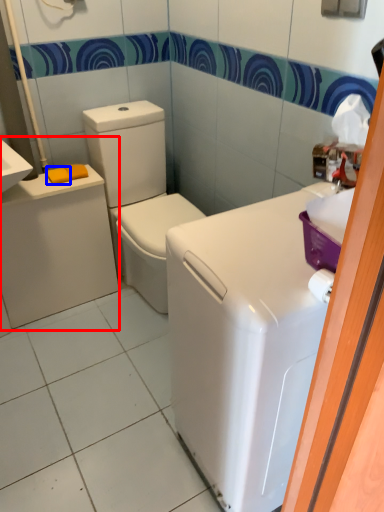
Question: Which object appears farthest to the camera in this image, porcelain (highlighted by a red box) or soap (highlighted by a blue box)?

Choices:
 (A) porcelain
 (B) soap

Answer: (B)